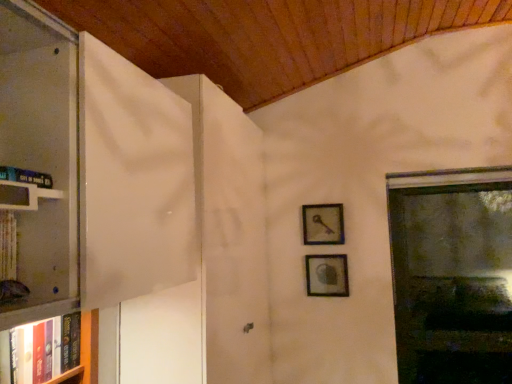
Question: Is hardcover book at left, positioned as the 1th book in bottom-to-top order, at the left side of metallic key at upper right, which is the first picture frame from top to bottom?

Choices:
 (A) no
 (B) yes

Answer: (B)

Question: Is metallic key at upper right, which is counted as the second picture frame, starting from the bottom, a part of hardcover book at left, the 2th book in the front-to-back sequence?

Choices:
 (A) yes
 (B) no

Answer: (B)

Question: Is hardcover book at left, the 2th book in the front-to-back sequence, positioned behind metallic key at upper right, which is the first picture frame from top to bottom?

Choices:
 (A) yes
 (B) no

Answer: (B)

Question: Can you confirm if hardcover book at left, the 2th book in the front-to-back sequence, is thinner than metallic key at upper right, which is counted as the second picture frame, starting from the bottom?

Choices:
 (A) no
 (B) yes

Answer: (A)

Question: Can you confirm if hardcover book at left, positioned as the 1th book in bottom-to-top order, is smaller than metallic key at upper right, which is counted as the second picture frame, starting from the bottom?

Choices:
 (A) no
 (B) yes

Answer: (A)

Question: From the image's perspective, is hardcover book at left, placed as the 1th book when sorted from front to back, positioned above or below metallic key at upper right, which is the first picture frame from top to bottom?

Choices:
 (A) below
 (B) above

Answer: (B)

Question: From a real-world perspective, is hardcover book at left, arranged as the second book when ordered from the bottom, physically located above or below metallic key at upper right, which is counted as the second picture frame, starting from the bottom?

Choices:
 (A) below
 (B) above

Answer: (B)

Question: Looking at their shapes, would you say hardcover book at left, the 1th book positioned from the top, is wider or thinner than metallic key at upper right, which is the first picture frame from top to bottom?

Choices:
 (A) wide
 (B) thin

Answer: (A)

Question: In the image, is hardcover book at left, placed as the 1th book when sorted from front to back, positioned in front of or behind metallic key at upper right, which is counted as the second picture frame, starting from the bottom?

Choices:
 (A) behind
 (B) front

Answer: (B)

Question: Is point (15, 170) closer or farther from the camera than point (18, 193)?

Choices:
 (A) farther
 (B) closer

Answer: (A)

Question: From a real-world perspective, relative to white glossy bookshelf at left, is hardcover book at left, the 1th book positioned from the top, vertically above or below?

Choices:
 (A) below
 (B) above

Answer: (B)

Question: Is hardcover book at left, which is the second book in back-to-front order, inside or outside of white glossy bookshelf at left?

Choices:
 (A) outside
 (B) inside

Answer: (A)

Question: From the image's perspective, is hardcover book at left, which is the second book in back-to-front order, located above or below white glossy bookshelf at left?

Choices:
 (A) below
 (B) above

Answer: (B)

Question: Considering the positions of white glossy bookshelf at left and matte silver picture frame at center-right, which appears as the second picture frame when viewed from the top, in the image, is white glossy bookshelf at left bigger or smaller than matte silver picture frame at center-right, which appears as the second picture frame when viewed from the top,?

Choices:
 (A) small
 (B) big

Answer: (A)

Question: Is white glossy bookshelf at left inside or outside of matte silver picture frame at center-right, the first picture frame when ordered from bottom to top?

Choices:
 (A) inside
 (B) outside

Answer: (B)